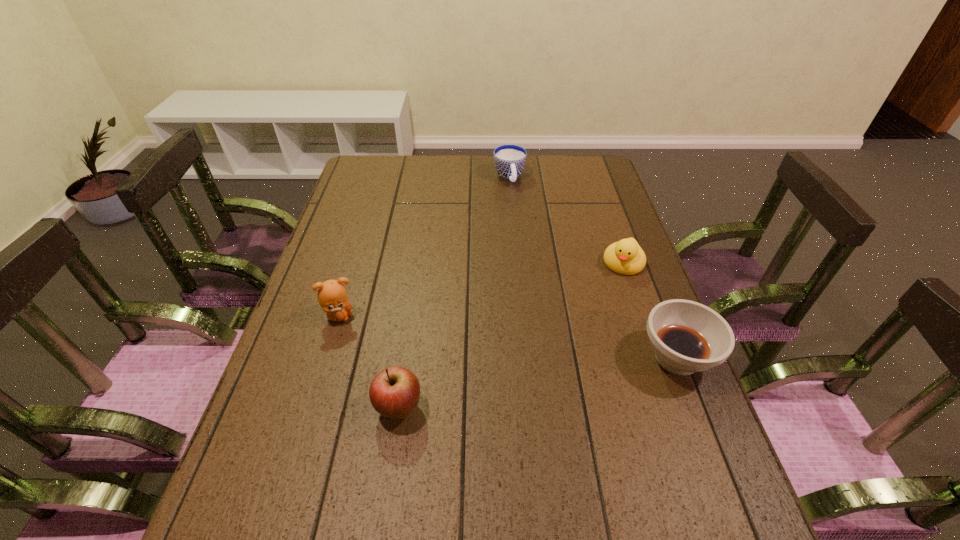
Identify the location of apple. Image resolution: width=960 pixels, height=540 pixels. (394, 393).

The image size is (960, 540). I want to click on soup bowl, so click(x=686, y=337).

Locate an element on the screen. This screenshot has height=540, width=960. teddy bear is located at coordinates (332, 296).

Where is `the leftmost object`? The height and width of the screenshot is (540, 960). the leftmost object is located at coordinates (332, 296).

Locate an element on the screen. the fourth nearest object is located at coordinates (626, 257).

Locate an element on the screen. This screenshot has width=960, height=540. the third object from left to right is located at coordinates pyautogui.click(x=509, y=160).

What are the coordinates of `cup` in the screenshot? It's located at (509, 160).

The width and height of the screenshot is (960, 540). What are the coordinates of `blank space located 0.180m on the back of the apple` in the screenshot? It's located at (411, 325).

This screenshot has width=960, height=540. What are the coordinates of `free space located 0.130m on the front of the soup bowl` in the screenshot? It's located at (712, 449).

Find the location of a particular element. free space located on the face of the third nearest object is located at coordinates (482, 356).